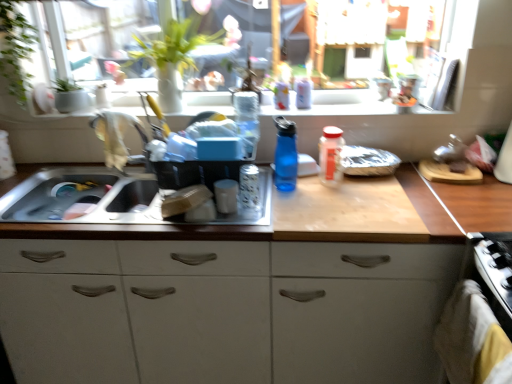
Question: Is matte white window sill at upper center wider than translucent plastic bottle at center, marked as the third bottle in a right-to-left arrangement?

Choices:
 (A) no
 (B) yes

Answer: (B)

Question: Can you confirm if matte white window sill at upper center is positioned to the left of translucent plastic bottle at center, marked as the third bottle in a right-to-left arrangement?

Choices:
 (A) yes
 (B) no

Answer: (A)

Question: Is matte white window sill at upper center positioned in front of translucent plastic bottle at center, marked as the 3th bottle in a left-to-right arrangement?

Choices:
 (A) yes
 (B) no

Answer: (A)

Question: Can you confirm if matte white window sill at upper center is shorter than translucent plastic bottle at center, marked as the 3th bottle in a left-to-right arrangement?

Choices:
 (A) no
 (B) yes

Answer: (B)

Question: Is matte white window sill at upper center turned away from translucent plastic bottle at center, marked as the 3th bottle in a left-to-right arrangement?

Choices:
 (A) no
 (B) yes

Answer: (A)

Question: Considering the relative positions of transparent glass window at upper center and blue plastic water bottle at center, placed as the 4th bottle when sorted from right to left, in the image provided, is transparent glass window at upper center to the left or to the right of blue plastic water bottle at center, placed as the 4th bottle when sorted from right to left,?

Choices:
 (A) left
 (B) right

Answer: (A)

Question: From the image's perspective, is transparent glass window at upper center above or below blue plastic water bottle at center, acting as the 2th bottle starting from the left?

Choices:
 (A) above
 (B) below

Answer: (A)

Question: Is transparent glass window at upper center inside or outside of blue plastic water bottle at center, placed as the 4th bottle when sorted from right to left?

Choices:
 (A) inside
 (B) outside

Answer: (B)

Question: In terms of size, does transparent glass window at upper center appear bigger or smaller than blue plastic water bottle at center, acting as the 2th bottle starting from the left?

Choices:
 (A) small
 (B) big

Answer: (B)

Question: Considering the positions of white matte cabinet at center and translucent glass jar at sink, arranged as the fifth bottle when viewed from the right, in the image, is white matte cabinet at center wider or thinner than translucent glass jar at sink, arranged as the fifth bottle when viewed from the right,?

Choices:
 (A) thin
 (B) wide

Answer: (B)

Question: From a real-world perspective, is white matte cabinet at center positioned above or below translucent glass jar at sink, arranged as the fifth bottle when viewed from the right?

Choices:
 (A) above
 (B) below

Answer: (B)

Question: Would you say white matte cabinet at center is to the left or to the right of translucent glass jar at sink, arranged as the fifth bottle when viewed from the right, in the picture?

Choices:
 (A) left
 (B) right

Answer: (A)

Question: Is white matte cabinet at center situated inside translucent glass jar at sink, the first bottle when ordered from left to right, or outside?

Choices:
 (A) outside
 (B) inside

Answer: (A)

Question: From a real-world perspective, is white plastic bottle at upper center, placed as the 2th bottle when sorted from right to left, physically located above or below transparent glass window at upper center?

Choices:
 (A) above
 (B) below

Answer: (B)

Question: Is white plastic bottle at upper center, positioned as the 4th bottle in left-to-right order, in front of or behind transparent glass window at upper center in the image?

Choices:
 (A) behind
 (B) front

Answer: (A)